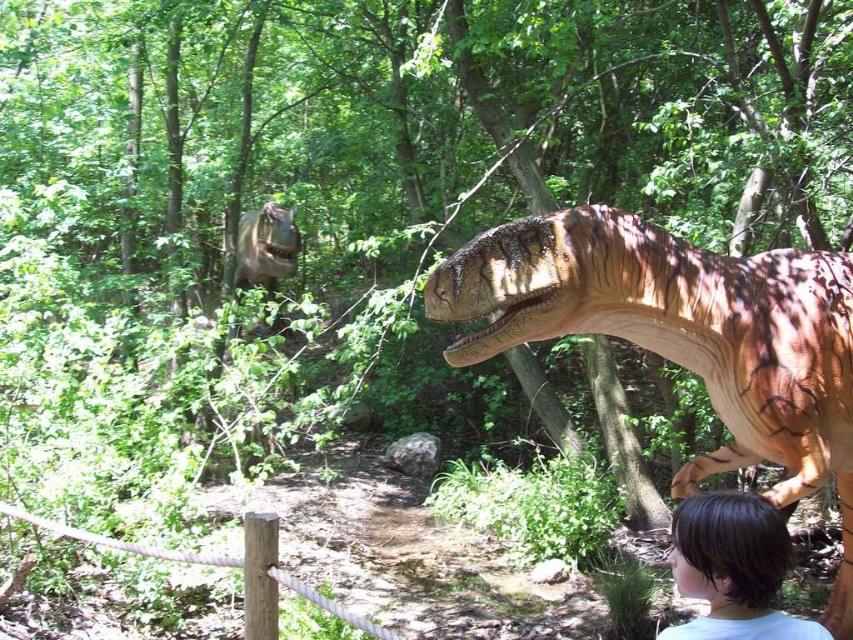
You are a parent trying to guide your child to the exit located near the brown rough wooden post at lower left. The child is currently looking at the brown textured dinosaur at center. Which direction should you tell the child to walk to reach the post?

The brown textured dinosaur at center is to the right of the brown rough wooden post at lower left. Therefore, the child should walk to the left to reach the post.

You are standing at point (282, 272) and want to walk to point (699, 509). Is the path between these two points clear of any obstacles?

Point (699, 509) is in front of point (282, 272), so the path between them is clear of any obstacles.